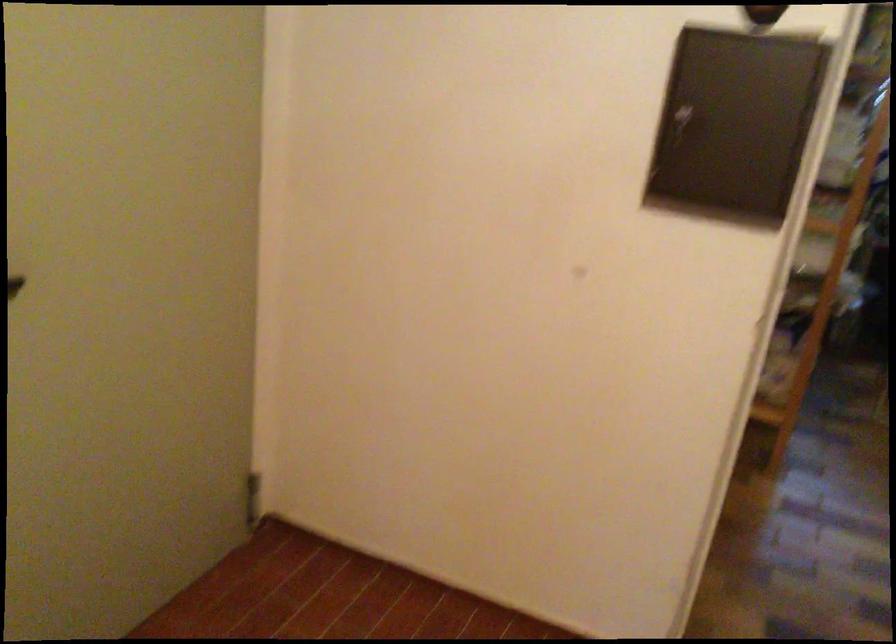
Where would you turn the dark door handle? Please return your answer as a coordinate pair (x, y).

(14, 285)